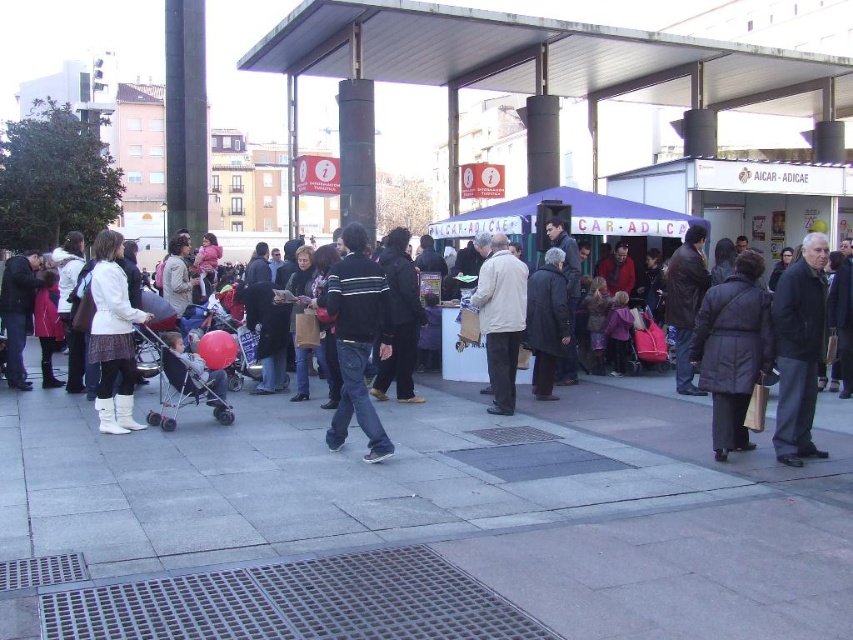
Question: Observing the image, what is the correct spatial positioning of dark gray jacket at right in reference to black cotton jacket at center?

Choices:
 (A) right
 (B) left

Answer: (A)

Question: Based on their relative distances, which object is nearer to the dark gray coat at center?

Choices:
 (A) gray concrete pavement at center
 (B) dark brown leather jacket at center
 (C) dark gray puffer coat at center
 (D) dark gray jacket at right

Answer: (B)

Question: Does black cotton jacket at center appear on the left side of dark gray coat at center?

Choices:
 (A) no
 (B) yes

Answer: (B)

Question: Which point is farther to the camera?

Choices:
 (A) (718, 452)
 (B) (169, 349)
 (C) (514, 312)
 (D) (399, 348)

Answer: (D)

Question: Which is farther from the dark brown leather boots at center?

Choices:
 (A) dark gray jacket at right
 (B) matte plastic baby carriage at left
 (C) dark gray puffer coat at center
 (D) beige fabric coat at center

Answer: (A)

Question: From the image, what is the correct spatial relationship of gray concrete pavement at center in relation to matte plastic baby carriage at left?

Choices:
 (A) above
 (B) below

Answer: (B)